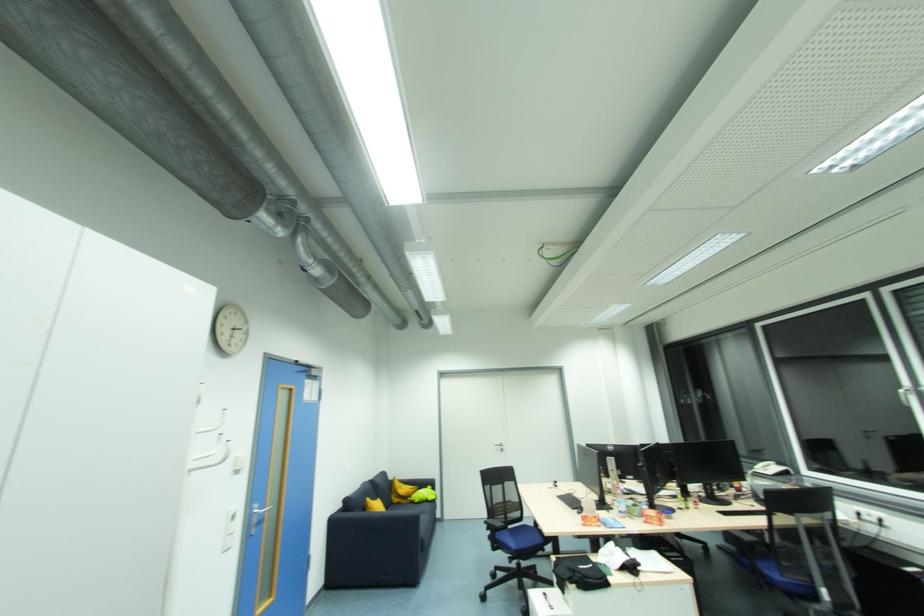
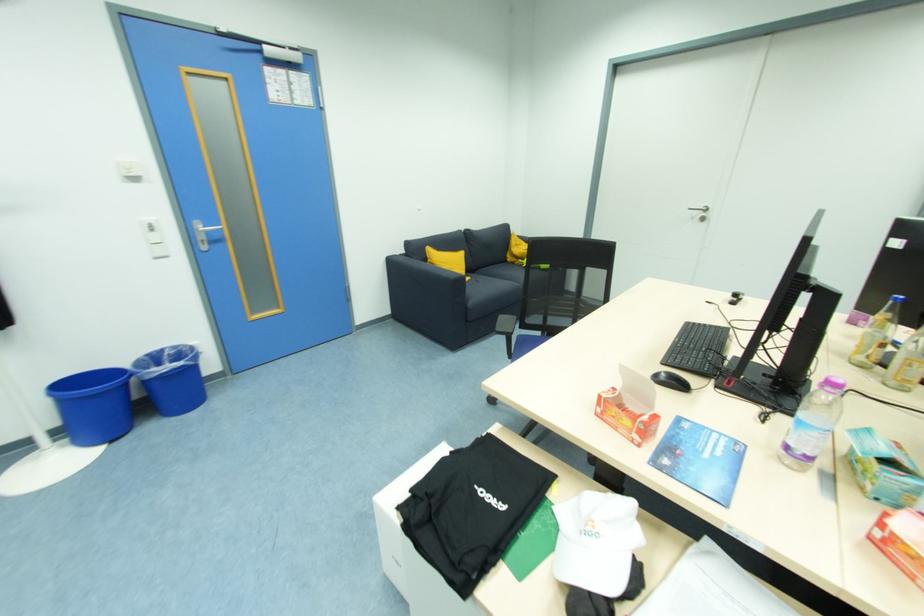
In the second image, find the point that corresponds to point (400, 505) in the first image.

(516, 265)